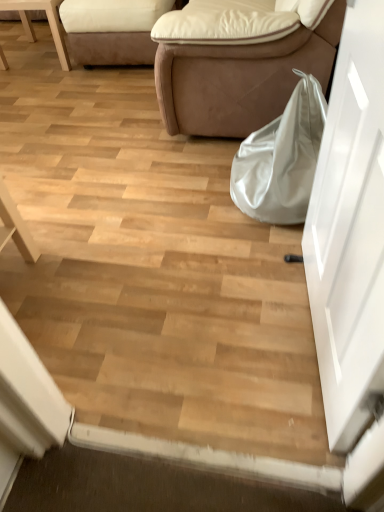
Question: From the image's perspective, is suede beige studio couch at upper left, the 2th studio couch positioned from the right, located beneath brown leather couch at center, the 2th studio couch positioned from the left?

Choices:
 (A) yes
 (B) no

Answer: (B)

Question: Considering the relative sizes of suede beige studio couch at upper left, the first studio couch in the left-to-right sequence, and brown leather couch at center, the 2th studio couch positioned from the left, in the image provided, is suede beige studio couch at upper left, the first studio couch in the left-to-right sequence, smaller than brown leather couch at center, the 2th studio couch positioned from the left,?

Choices:
 (A) no
 (B) yes

Answer: (B)

Question: Is suede beige studio couch at upper left, the 2th studio couch positioned from the right, bigger than brown leather couch at center, which is the first studio couch in right-to-left order?

Choices:
 (A) yes
 (B) no

Answer: (B)

Question: Can you confirm if suede beige studio couch at upper left, the 2th studio couch positioned from the right, is positioned to the left of brown leather couch at center, the 2th studio couch positioned from the left?

Choices:
 (A) no
 (B) yes

Answer: (B)

Question: Considering the relative sizes of suede beige studio couch at upper left, the first studio couch in the left-to-right sequence, and brown leather couch at center, which is the first studio couch in right-to-left order, in the image provided, is suede beige studio couch at upper left, the first studio couch in the left-to-right sequence, taller than brown leather couch at center, which is the first studio couch in right-to-left order,?

Choices:
 (A) no
 (B) yes

Answer: (A)

Question: Based on their positions, is white leather chair at upper left located to the left or right of white glossy door at right?

Choices:
 (A) left
 (B) right

Answer: (A)

Question: Is white leather chair at upper left in front of or behind white glossy door at right in the image?

Choices:
 (A) front
 (B) behind

Answer: (B)

Question: From the image's perspective, is white leather chair at upper left positioned above or below white glossy door at right?

Choices:
 (A) below
 (B) above

Answer: (B)

Question: Looking at the image, does white leather chair at upper left seem bigger or smaller compared to white glossy door at right?

Choices:
 (A) big
 (B) small

Answer: (A)

Question: Would you say white glossy door at right is to the left or to the right of suede beige studio couch at upper left, the 2th studio couch positioned from the right, in the picture?

Choices:
 (A) right
 (B) left

Answer: (A)

Question: In terms of size, does white glossy door at right appear bigger or smaller than suede beige studio couch at upper left, the 2th studio couch positioned from the right?

Choices:
 (A) big
 (B) small

Answer: (B)

Question: Considering the positions of white glossy door at right and suede beige studio couch at upper left, the first studio couch in the left-to-right sequence, in the image, is white glossy door at right taller or shorter than suede beige studio couch at upper left, the first studio couch in the left-to-right sequence,?

Choices:
 (A) tall
 (B) short

Answer: (A)

Question: Looking at their shapes, would you say white glossy door at right is wider or thinner than suede beige studio couch at upper left, the first studio couch in the left-to-right sequence?

Choices:
 (A) thin
 (B) wide

Answer: (A)

Question: Is suede beige studio couch at upper left, the first studio couch in the left-to-right sequence, to the left or to the right of brown leather couch at center, the 2th studio couch positioned from the left, in the image?

Choices:
 (A) left
 (B) right

Answer: (A)

Question: Considering their positions, is suede beige studio couch at upper left, the first studio couch in the left-to-right sequence, located in front of or behind brown leather couch at center, which is the first studio couch in right-to-left order?

Choices:
 (A) front
 (B) behind

Answer: (B)